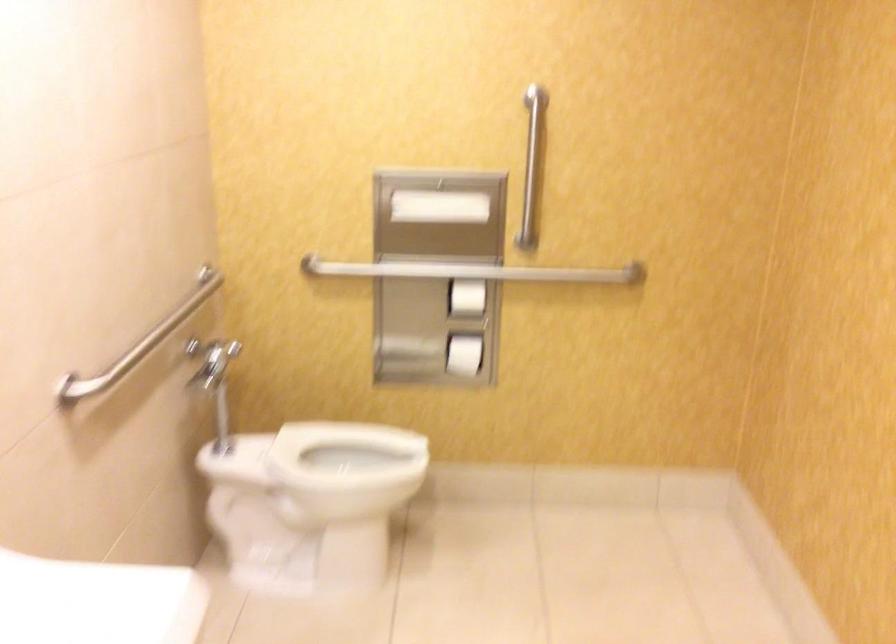
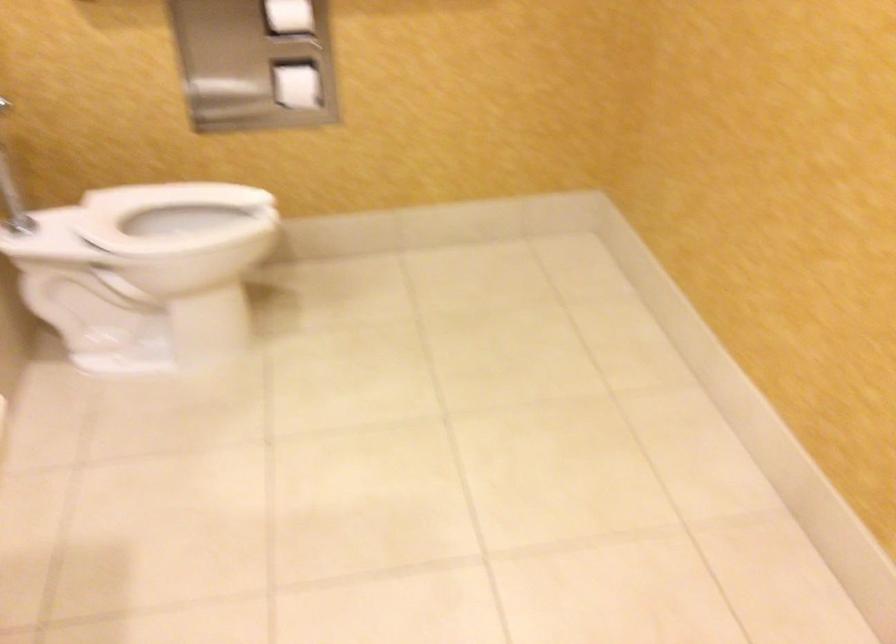
Where in the second image is the point corresponding to point (466, 299) from the first image?

(289, 15)